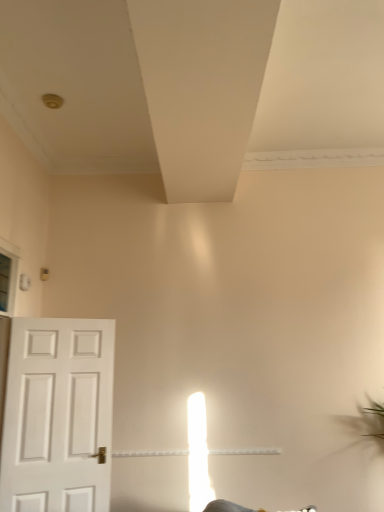
Question: Does white matte exhaust hood at upper center have a larger size compared to white matte door at left?

Choices:
 (A) no
 (B) yes

Answer: (A)

Question: Could you tell me if white matte exhaust hood at upper center is facing white matte door at left?

Choices:
 (A) no
 (B) yes

Answer: (A)

Question: Would you say white matte exhaust hood at upper center is outside white matte door at left?

Choices:
 (A) yes
 (B) no

Answer: (A)

Question: Can you confirm if white matte exhaust hood at upper center is wider than white matte door at left?

Choices:
 (A) no
 (B) yes

Answer: (B)

Question: Would you say white matte exhaust hood at upper center is a long distance from white matte door at left?

Choices:
 (A) yes
 (B) no

Answer: (A)

Question: From the image's perspective, is white matte exhaust hood at upper center on white matte door at left?

Choices:
 (A) yes
 (B) no

Answer: (A)

Question: Does white matte door at left have a smaller size compared to white matte exhaust hood at upper center?

Choices:
 (A) no
 (B) yes

Answer: (A)

Question: Can you confirm if white matte door at left is shorter than white matte exhaust hood at upper center?

Choices:
 (A) no
 (B) yes

Answer: (A)

Question: Is white matte door at left at the left side of white matte exhaust hood at upper center?

Choices:
 (A) yes
 (B) no

Answer: (A)

Question: Is white matte door at left facing towards white matte exhaust hood at upper center?

Choices:
 (A) no
 (B) yes

Answer: (A)

Question: Is white matte door at left turned away from white matte exhaust hood at upper center?

Choices:
 (A) yes
 (B) no

Answer: (B)

Question: From the image's perspective, is white matte door at left on white matte exhaust hood at upper center?

Choices:
 (A) yes
 (B) no

Answer: (B)

Question: Is point (100, 361) closer or farther from the camera than point (246, 119)?

Choices:
 (A) farther
 (B) closer

Answer: (A)